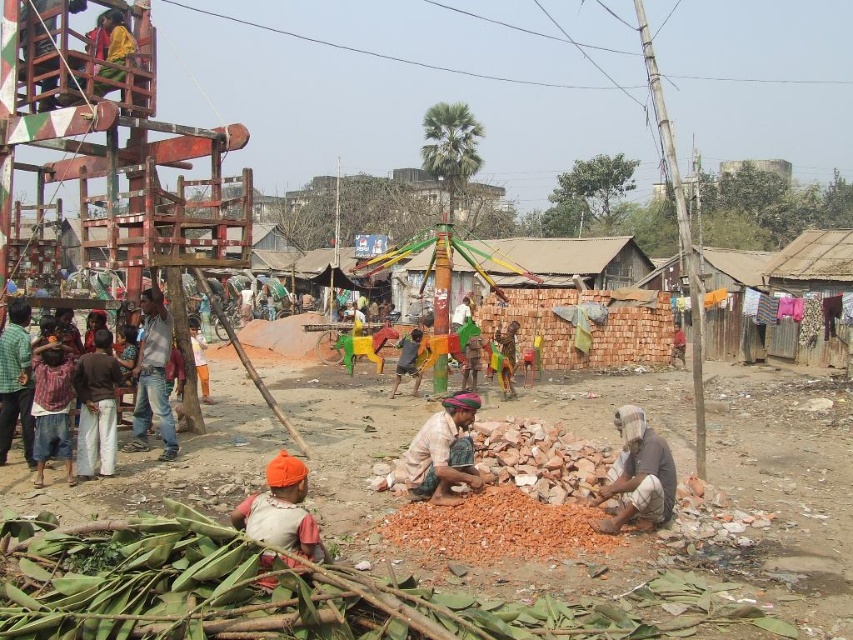
Is point (468, 419) farther from camera compared to point (99, 433)?

No, (468, 419) is in front of (99, 433).

Does brown woven cloth at center have a greater height compared to brown cotton pants at left?

No.

Which is behind, point (427, 451) or point (94, 436)?

Point (94, 436)

Find the location of a particular element. brown woven cloth at center is located at coordinates (440, 452).

Does point (422, 460) come closer to viewer compared to point (41, 384)?

Yes, point (422, 460) is in front of point (41, 384).

Can you confirm if brown woven cloth at center is positioned to the right of plaid shirt at left?

Correct, you'll find brown woven cloth at center to the right of plaid shirt at left.

You are a GUI agent. You are given a task and a screenshot of the screen. Output one action in this format:
    pyautogui.click(x=<x>, y=<y>)
    Task: Click on the brown woven cloth at center
    The width and height of the screenshot is (853, 640).
    Given the screenshot: What is the action you would take?
    pyautogui.click(x=440, y=452)

Is brown cotton pants at left shorter than jeans at center?

Yes.

Is brown cotton pants at left bigger than jeans at center?

Incorrect, brown cotton pants at left is not larger than jeans at center.

Image resolution: width=853 pixels, height=640 pixels. Describe the element at coordinates (96, 408) in the screenshot. I see `brown cotton pants at left` at that location.

This screenshot has height=640, width=853. I want to click on brown cotton pants at left, so click(96, 408).